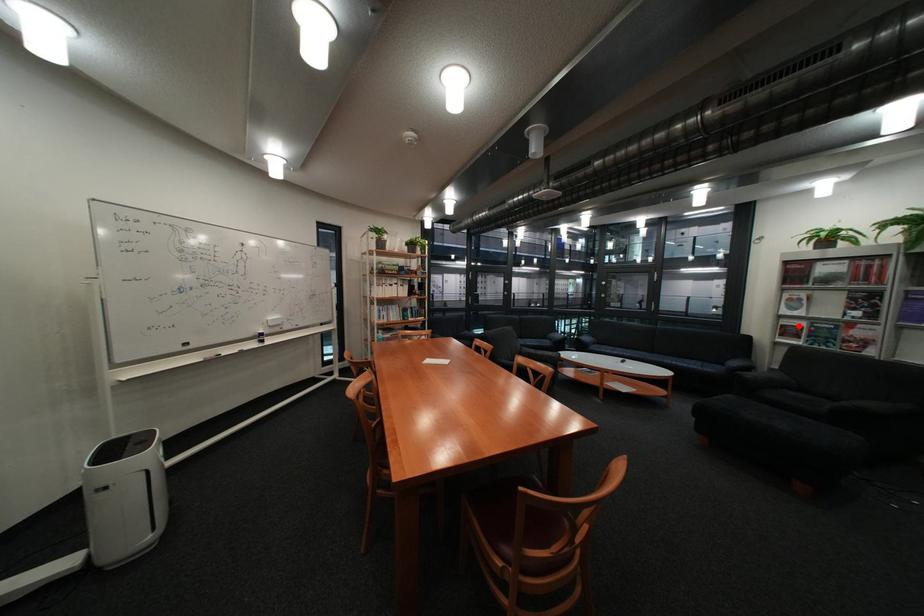
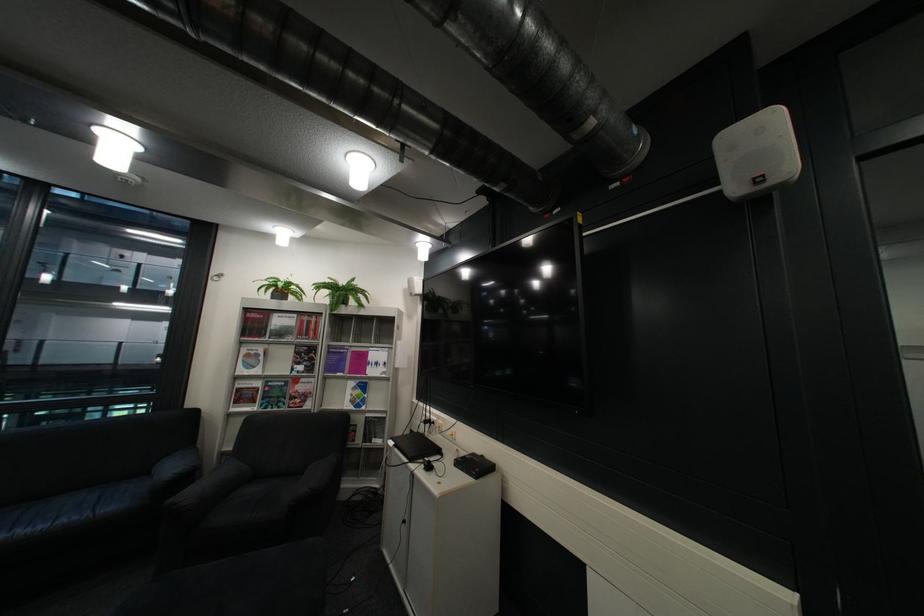
Find the pixel in the second image that matches the highlighted location in the first image.

(254, 390)